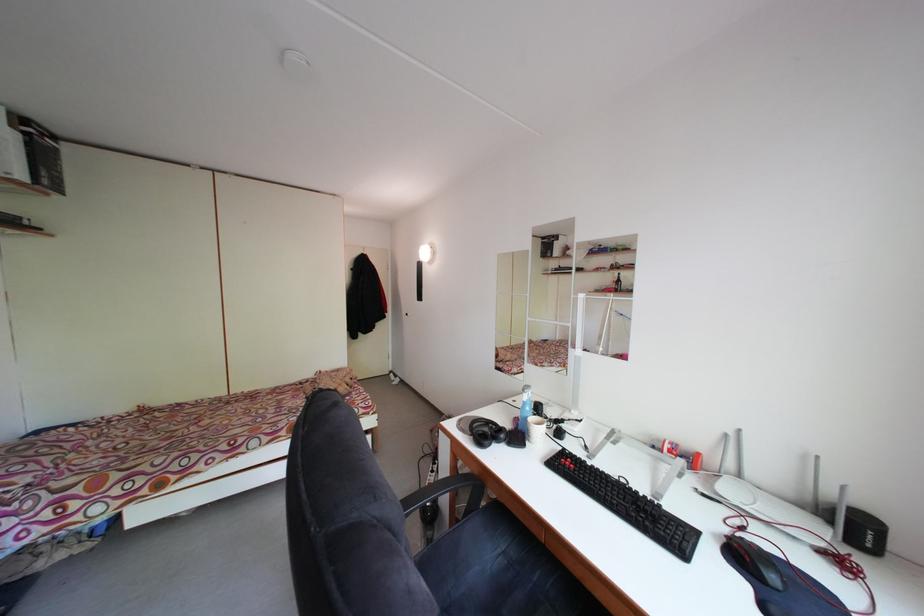
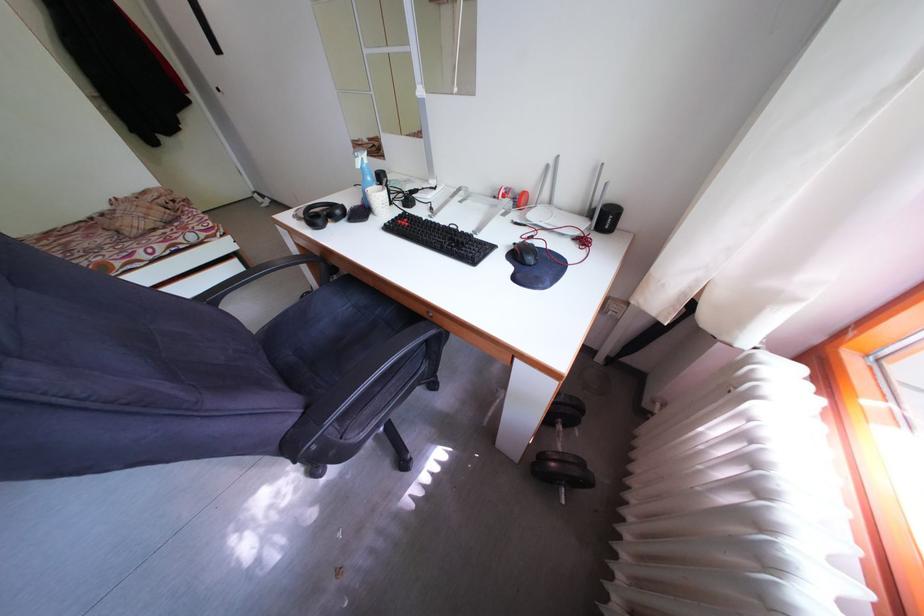
Find the pixel in the second image that matches (x=735, y=536) in the first image.

(527, 246)